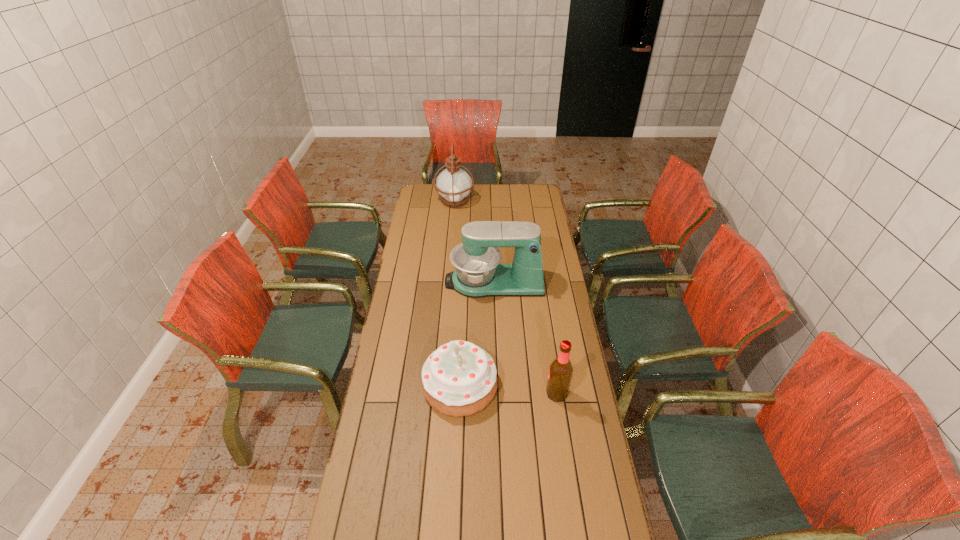
This screenshot has height=540, width=960. I want to click on free space between the beer bottle and the cake, so click(509, 389).

Find the location of `vacant space that's between the farthest object and the cake`. vacant space that's between the farthest object and the cake is located at coordinates (457, 293).

Where is `vacant area between the mixer and the beer bottle`? The image size is (960, 540). vacant area between the mixer and the beer bottle is located at coordinates (526, 338).

Locate which object is the second closest to the second farthest object. Please provide its 2D coordinates. Your answer should be formatted as a tuple, i.e. [(x, y)], where the tuple contains the x and y coordinates of a point satisfying the conditions above.

[(560, 373)]

Point out which object is positioned as the nearest to the beer bottle. Please provide its 2D coordinates. Your answer should be formatted as a tuple, i.e. [(x, y)], where the tuple contains the x and y coordinates of a point satisfying the conditions above.

[(459, 378)]

Find the location of a particular element. vacant point that satisfies the following two spatial constraints: 1. on the front side of the farthest object; 2. on the left side of the beer bottle is located at coordinates (438, 394).